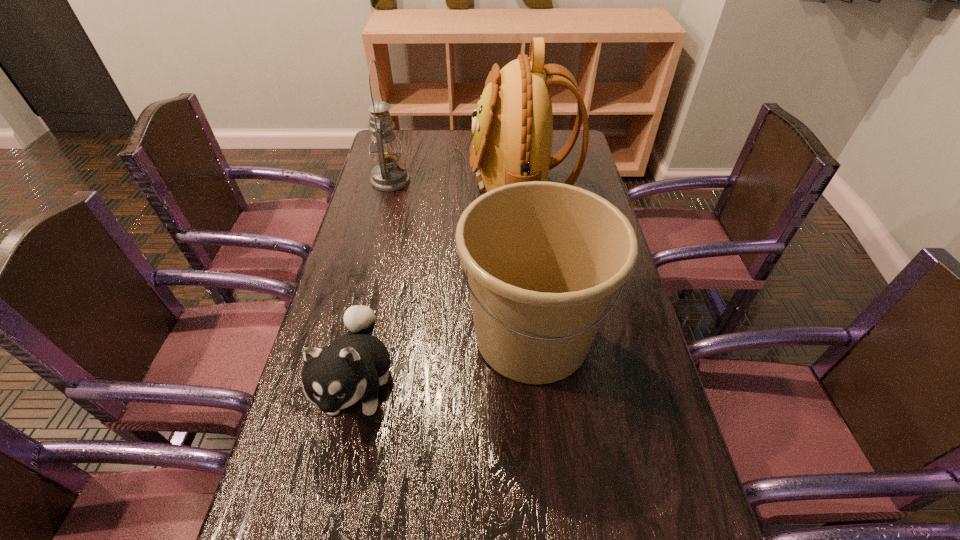
Where is `backpack`? backpack is located at coordinates (512, 128).

Image resolution: width=960 pixels, height=540 pixels. What are the coordinates of `oil lamp` in the screenshot? It's located at (389, 175).

Locate an element on the screen. The width and height of the screenshot is (960, 540). the second shortest object is located at coordinates 543,259.

What are the coordinates of `puppy` in the screenshot? It's located at (353, 366).

Where is `vacant space positioned 0.180m on the front-facing side of the tallest object`? vacant space positioned 0.180m on the front-facing side of the tallest object is located at coordinates (420, 188).

Locate an element on the screen. Image resolution: width=960 pixels, height=540 pixels. free space located 0.200m on the front-facing side of the tallest object is located at coordinates (414, 188).

Identify the location of free location located on the front-facing side of the tallest object. (405, 188).

Locate an element on the screen. The image size is (960, 540). free space located on the right of the oil lamp is located at coordinates (507, 180).

Where is `vacant space located 0.160m on the front of the third tallest object`? The image size is (960, 540). vacant space located 0.160m on the front of the third tallest object is located at coordinates (546, 475).

The height and width of the screenshot is (540, 960). I want to click on free location located 0.150m at the face of the puppy, so click(327, 528).